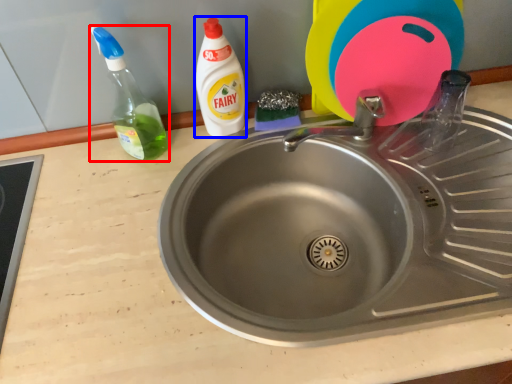
Question: Which of the following is the farthest to the observer, bottle (highlighted by a red box) or cleaning product (highlighted by a blue box)?

Choices:
 (A) bottle
 (B) cleaning product

Answer: (B)